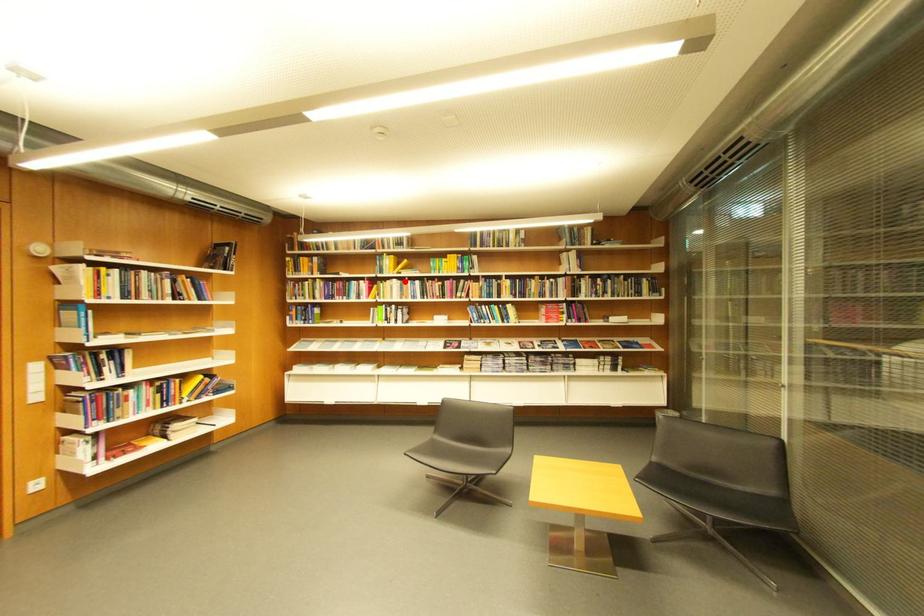
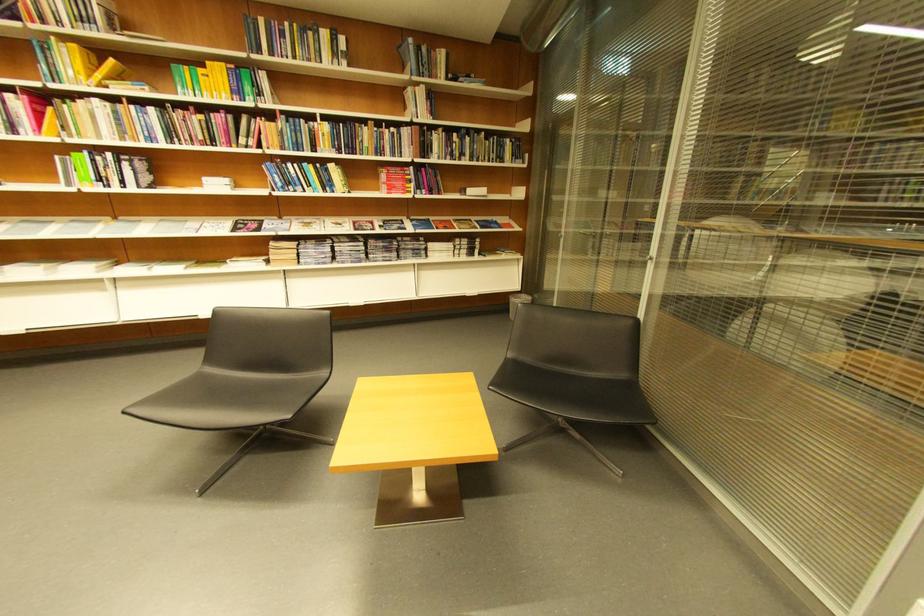
Question: A red point is marked in image1. In image2, is the corresponding 3D point closer to the camera or farther? Reply with the corresponding letter.

Choices:
 (A) The corresponding 3D point is closer.
 (B) The corresponding 3D point is farther.

Answer: (B)